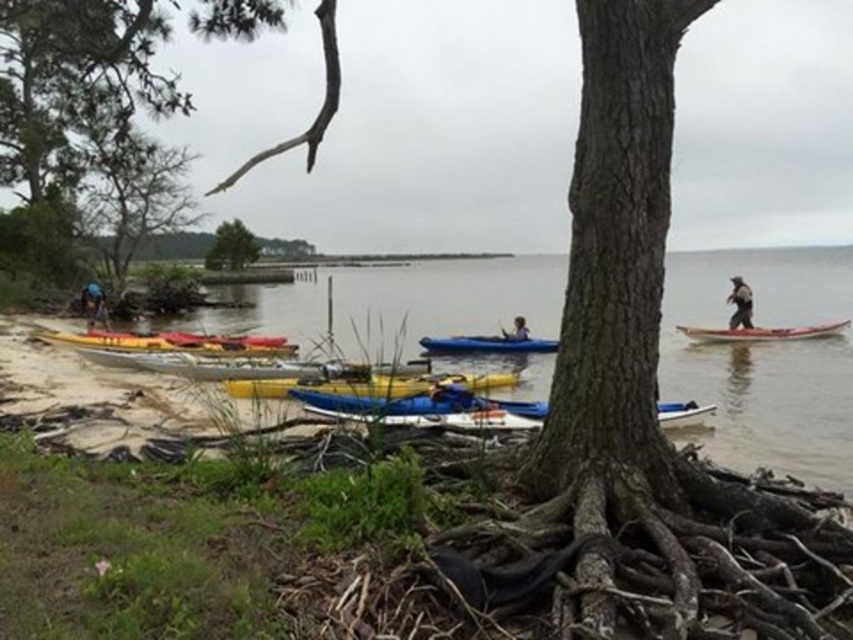
Who is more distant from viewer, (224, 236) or (99, 314)?

Positioned behind is point (224, 236).

Who is shorter, green leafy tree at center or blue fabric at lower left?

blue fabric at lower left

Identify the location of green leafy tree at center. (231, 246).

Find the location of a particular element. The width and height of the screenshot is (853, 640). smooth pink kayak at right is located at coordinates (762, 332).

Is smooth pink kayak at right to the left of green leafy tree at center from the viewer's perspective?

No, smooth pink kayak at right is not to the left of green leafy tree at center.

Identify the location of smooth pink kayak at right. (762, 332).

This screenshot has width=853, height=640. I want to click on smooth pink kayak at right, so click(762, 332).

Is dark gray fabric at right positioned at the back of blue fabric at lower left?

No, it is in front of blue fabric at lower left.

Does point (741, 324) lie behind point (86, 298)?

No, (741, 324) is in front of (86, 298).

Between point (741, 310) and point (86, 298), which one is positioned in front?

Point (741, 310) is more forward.

Identify the location of dark gray fabric at right. (740, 304).